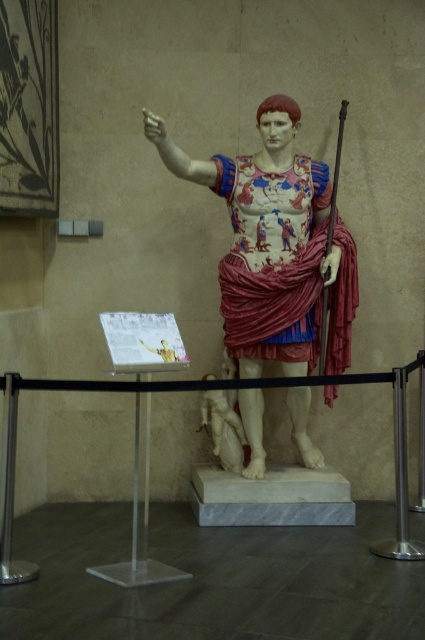
You are standing in a museum and see two statues. The first is labeled as the marble statue at center, and the second is labeled as the marble statue of a figure at center. According to the description, which statue is positioned to the right of the other?

The marble statue at center is positioned to the right of the marble statue of a figure at center.

You are an art curator planning to display the marble statue at center and the marble statue of a figure at center in a narrow corridor. Which statue should you choose to fit better in the space?

The marble statue of a figure at center has a smaller width than the marble statue at center, so it would fit better in the narrow corridor.

You are an art conservator examining the statue from the front. You notice two points on the statue marked as point 1 at coordinates (294, 284) and point 2 at coordinates (206, 419). Which point is nearer to your current viewpoint?

Point 1 at coordinates (294, 284) is closer to the viewer than point 2 at coordinates (206, 419).